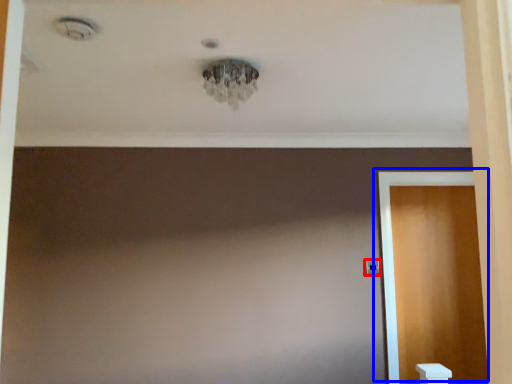
Question: Among these objects, which one is nearest to the camera, door handle (highlighted by a red box) or door (highlighted by a blue box)?

Choices:
 (A) door handle
 (B) door

Answer: (B)